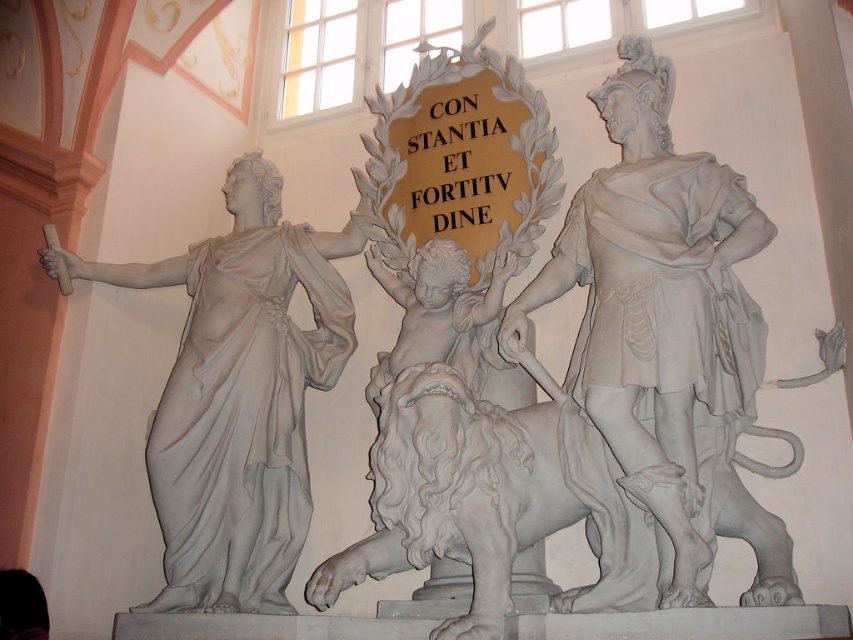
You are an art conservator tasked with measuring the statues for preservation. Given that the white marble statue at left is 1.8 meters tall, what is the minimum height the white marble statue at right must be to ensure it meets the required preservation standards for taller statues?

The white marble statue at right is taller than the white marble statue at left, which is 1.8 meters. Therefore, the minimum height the white marble statue at right must be is just over 1.8 meters to meet the required preservation standards for taller statues.

You are a tour guide leading a group through the museum. You want to ensure visitors can comfortably walk between the two white marble statues. The minimum required space for safe passage is 50 feet. Can visitors walk between the white marble statue at right and the white marble statue at left?

The distance between the white marble statue at right and the white marble statue at left is 61.04 feet, which exceeds the 50 feet requirement. Therefore, visitors can comfortably walk between them.

You are an art conservator assessing the spatial arrangement of the white marble statue at right and the white marble statue at left in the classical sculpture group. Which statue occupies a larger physical space due to its dimensions?

The white marble statue at left is larger in size compared to the white marble statue at right, so it occupies a larger physical space.